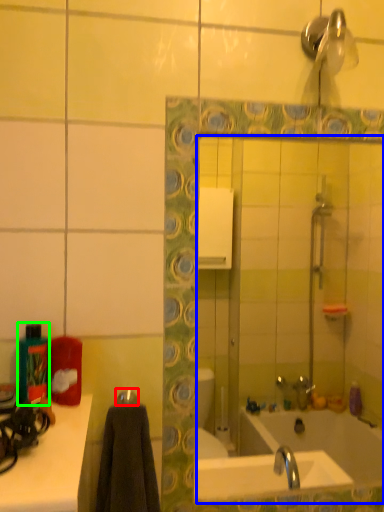
Question: Considering the real-world distances, which object is closest to towel bar (highlighted by a red box)? mirror (highlighted by a blue box) or bottle (highlighted by a green box).

Choices:
 (A) mirror
 (B) bottle

Answer: (B)